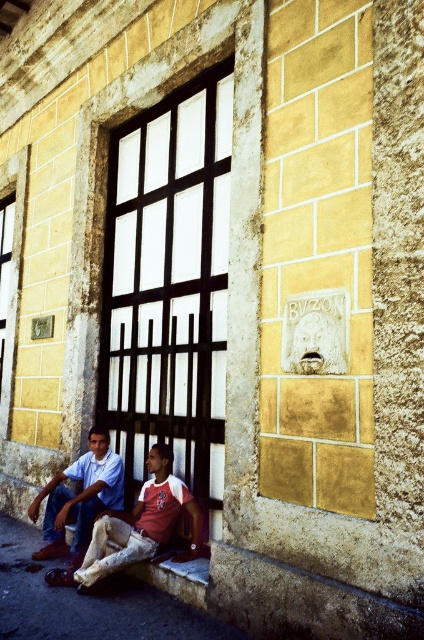
Question: Which of the following is the farthest from the observer?

Choices:
 (A) wooden bars at center
 (B) white cotton shirt at lower left

Answer: (A)

Question: Is white cotton shirt at lower left wider than matte blue jeans at lower left?

Choices:
 (A) yes
 (B) no

Answer: (A)

Question: Can you confirm if wooden bars at center is positioned to the left of white cotton shirt at lower left?

Choices:
 (A) no
 (B) yes

Answer: (A)

Question: Considering the real-world distances, which object is closest to the wooden bars at center?

Choices:
 (A) white cotton shirt at lower left
 (B) matte blue jeans at lower left

Answer: (B)

Question: Among these points, which one is nearest to the camera?

Choices:
 (A) (58, 474)
 (B) (148, 253)
 (C) (200, 516)

Answer: (C)

Question: Does white cotton shirt at lower left appear under matte blue jeans at lower left?

Choices:
 (A) no
 (B) yes

Answer: (B)